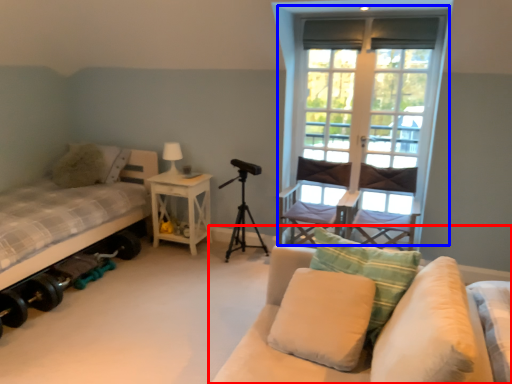
Question: Which object is closer to the camera taking this photo, studio couch (highlighted by a red box) or window (highlighted by a blue box)?

Choices:
 (A) studio couch
 (B) window

Answer: (A)